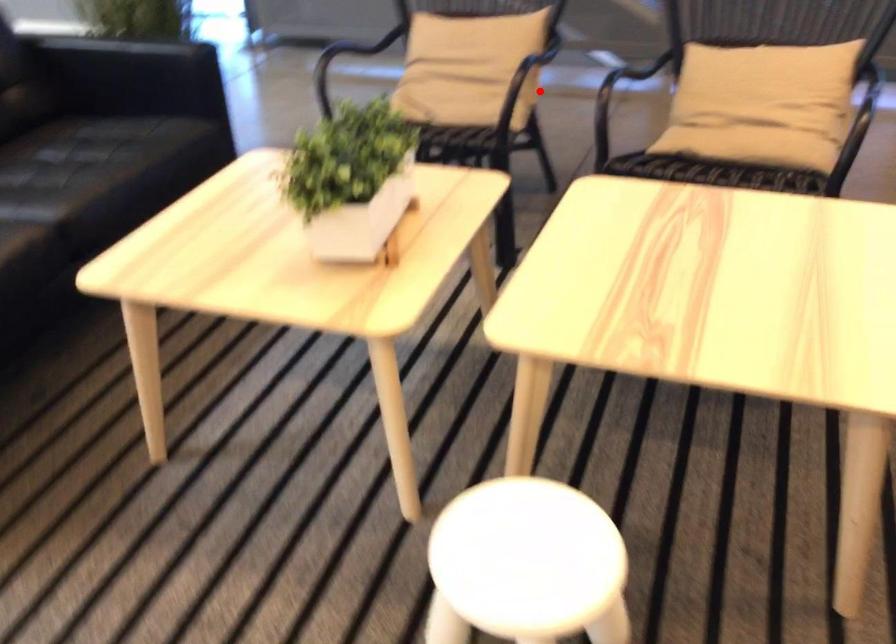
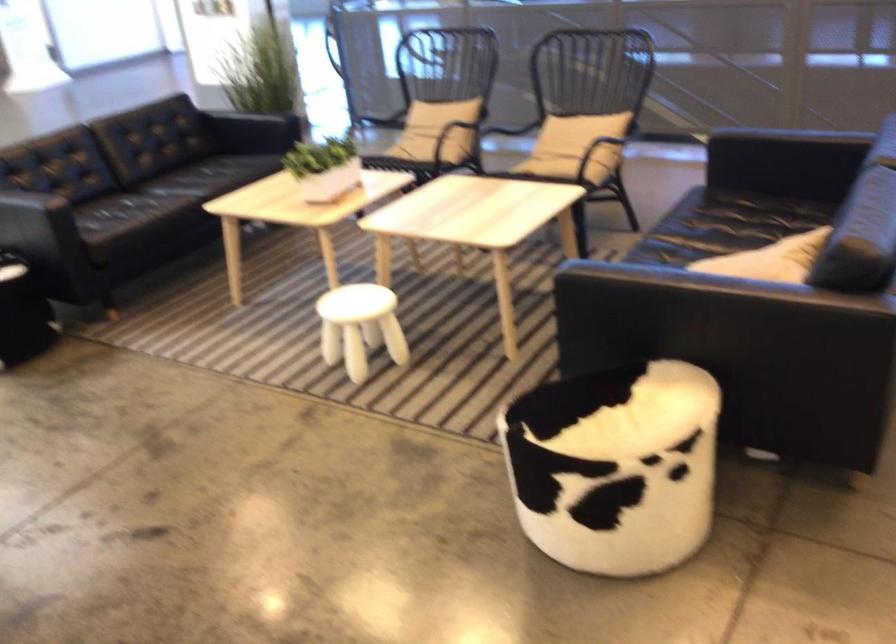
Where in the second image is the point corresponding to the highlighted location from the first image?

(450, 135)